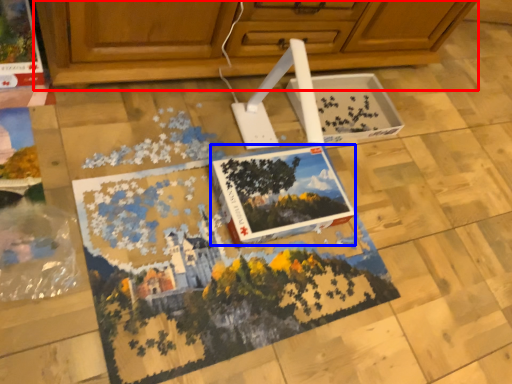
Question: Which object appears farthest to the camera in this image, cabinetry (highlighted by a red box) or magazine (highlighted by a blue box)?

Choices:
 (A) cabinetry
 (B) magazine

Answer: (B)